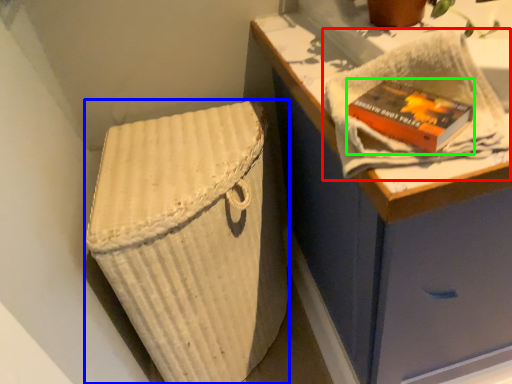
Question: Which object is the farthest from bath towel (highlighted by a red box)? Choose among these: laundry basket (highlighted by a blue box) or paperback book (highlighted by a green box).

Choices:
 (A) laundry basket
 (B) paperback book

Answer: (A)